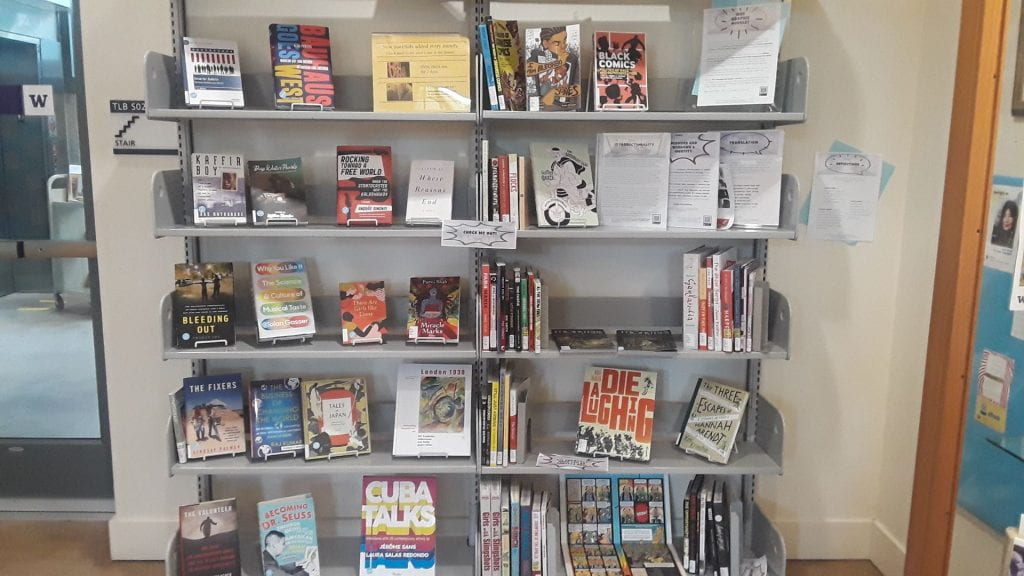
Find the location of `tan mobile book rack`. tan mobile book rack is located at coordinates (58, 200).